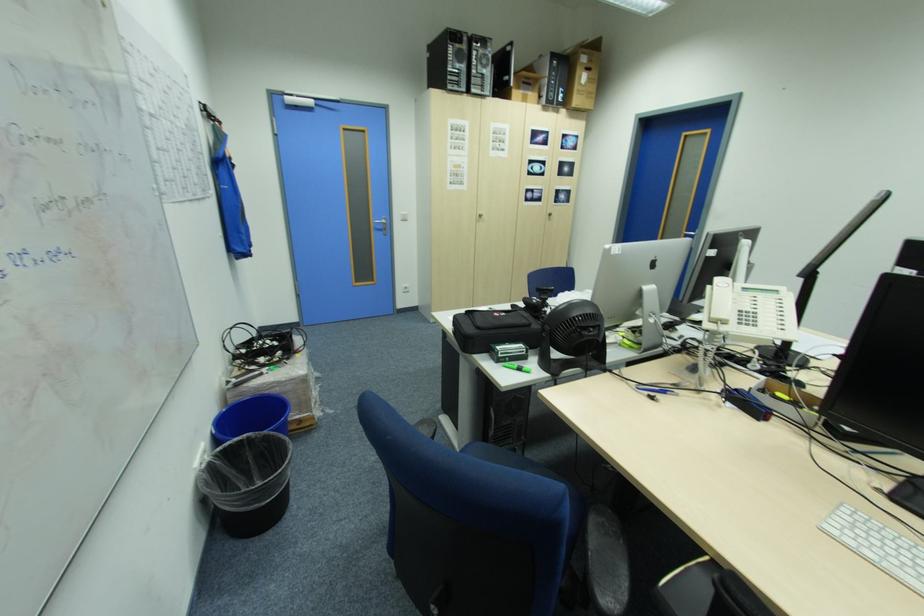
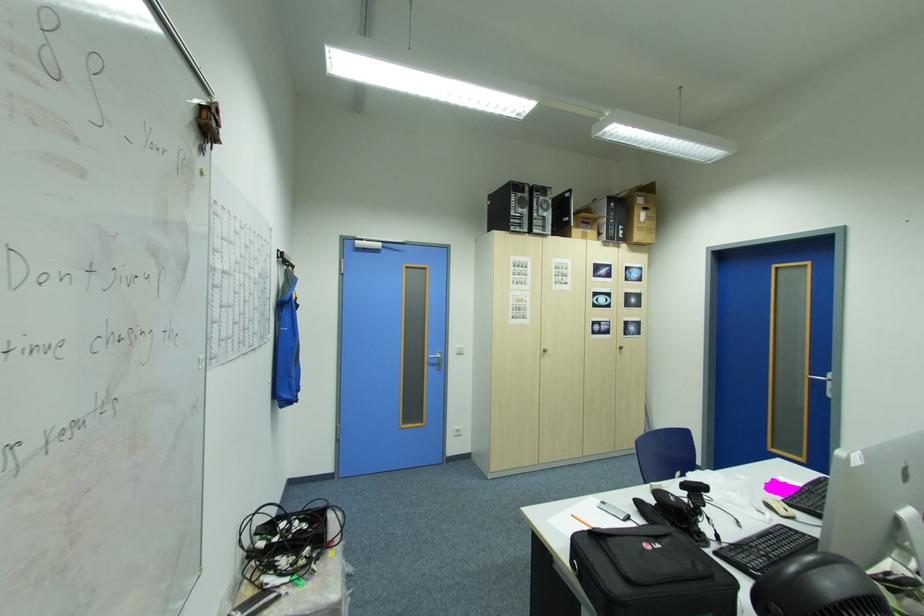
The point at (379, 225) is marked in the first image. Where is the corresponding point in the second image?

(432, 361)